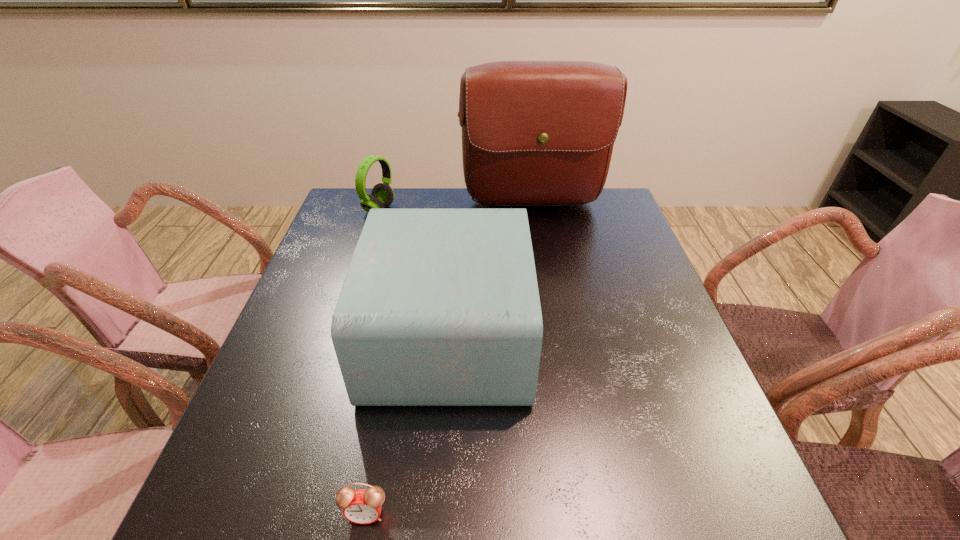
You are a GUI agent. You are given a task and a screenshot of the screen. Output one action in this format:
    pyautogui.click(x=<x>, y=<y>)
    Task: Click on the satchel that is at the far edge
    This screenshot has width=960, height=540.
    Given the screenshot: What is the action you would take?
    pyautogui.click(x=534, y=133)

Locate an element on the screen. headset located at the far edge is located at coordinates (382, 195).

Image resolution: width=960 pixels, height=540 pixels. Find the location of `object located at the near edge`. object located at the near edge is located at coordinates coord(363,506).

I want to click on object present at the left edge, so click(382, 195).

Where is `object present at the right edge`? The height and width of the screenshot is (540, 960). object present at the right edge is located at coordinates (534, 133).

At what (x,y) coordinates should I click in order to perform the action: click on object that is positioned at the far left corner. Please return your answer as a coordinate pair (x, y). The width and height of the screenshot is (960, 540). Looking at the image, I should click on (382, 195).

Find the location of a particular element. The width and height of the screenshot is (960, 540). object at the far right corner is located at coordinates (534, 133).

Locate an element on the screen. The width and height of the screenshot is (960, 540). vacant space at the far edge of the desktop is located at coordinates (540, 211).

What are the coordinates of `free space at the near edge of the desktop` in the screenshot? It's located at pos(468,494).

Find the location of a particular element. This screenshot has width=960, height=540. free space at the left edge of the desktop is located at coordinates (307, 366).